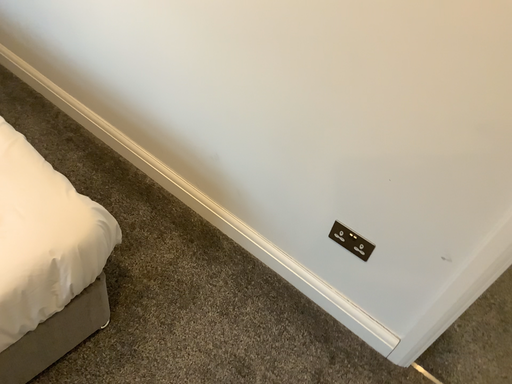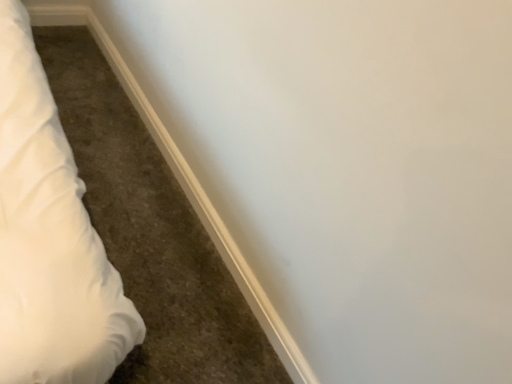
Question: Which way did the camera rotate in the video?

Choices:
 (A) rotated left
 (B) rotated right

Answer: (A)